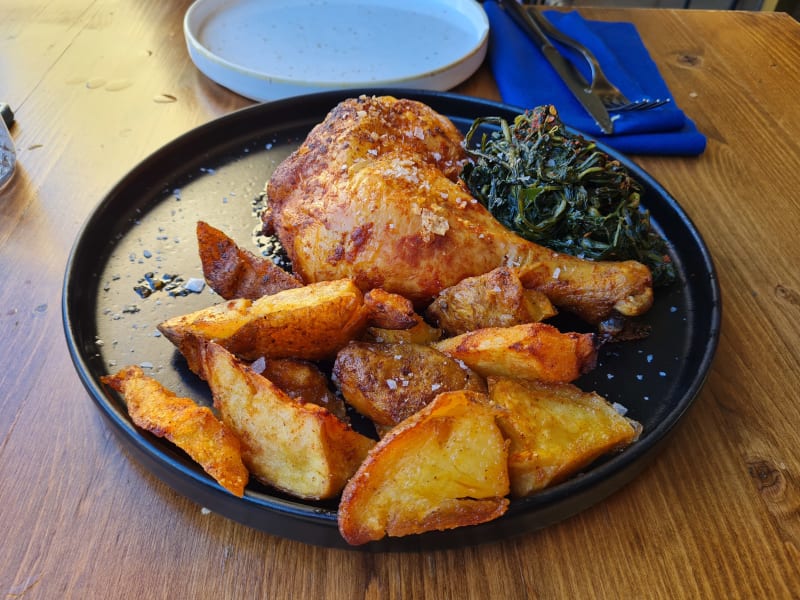
This screenshot has height=600, width=800. I want to click on brown table, so click(717, 73).